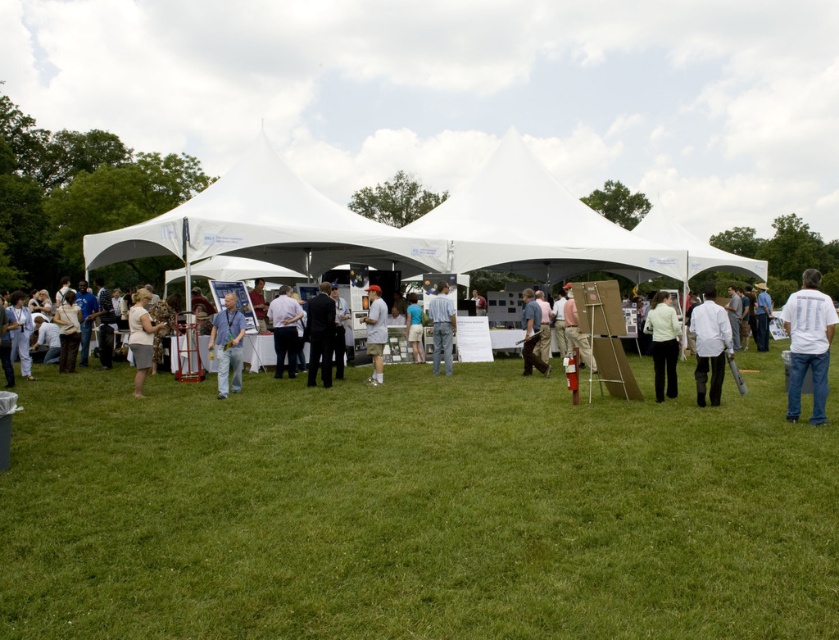
Question: Can you confirm if light blue shirt at center is positioned below white fabric tent at center?

Choices:
 (A) yes
 (B) no

Answer: (A)

Question: Which of the following is the farthest from the observer?

Choices:
 (A) (519, 531)
 (B) (405, 324)
 (C) (447, 344)
 (D) (308, 262)

Answer: (D)

Question: Does white fabric canopy at center lie in front of dark blue suit at center?

Choices:
 (A) yes
 (B) no

Answer: (B)

Question: Considering the relative positions of matte white blouse at center and blue fabric tent at center in the image provided, where is matte white blouse at center located with respect to blue fabric tent at center?

Choices:
 (A) left
 (B) right

Answer: (A)

Question: Which point appears farthest from the camera in this image?

Choices:
 (A) (266, 138)
 (B) (133, 333)
 (C) (287, 291)

Answer: (A)

Question: Which point is closer to the camera taking this photo?

Choices:
 (A) (707, 355)
 (B) (68, 316)
 (C) (764, 307)

Answer: (A)